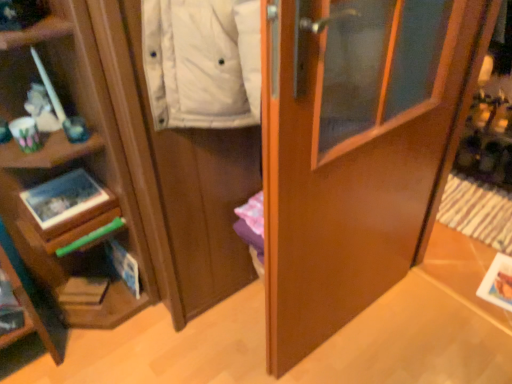
At what (x,y) coordinates should I click in order to perform the action: click on unoccupied area in front of glossy wood door at center. Please return your answer as a coordinate pair (x, y). This screenshot has height=384, width=512. Looking at the image, I should click on (364, 357).